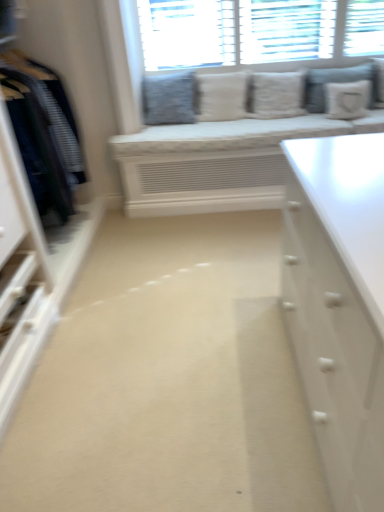
Question: From the image's perspective, is white textured pillow at center, which is counted as the 4th pillow, starting from the right, positioned above or below white textured pillows at upper center?

Choices:
 (A) above
 (B) below

Answer: (B)

Question: Is white textured pillow at center, the second pillow from the left, wider or thinner than white textured pillows at upper center?

Choices:
 (A) wide
 (B) thin

Answer: (A)

Question: Estimate the real-world distances between objects in this image. Which object is farther from the white textured pillow at center, acting as the 3th pillow starting from the right?

Choices:
 (A) gray fabric pillow at upper right, which is the second pillow in right-to-left order
 (B) white textured pillows at upper center
 (C) white fabric pillow at upper right, the fifth pillow when ordered from left to right
 (D) textured gray pillow at upper center, arranged as the fifth pillow when viewed from the right
 (E) dark blue fabric at left

Answer: (E)

Question: Which object is positioned closest to the dark blue fabric at left?

Choices:
 (A) white textured pillow at center, acting as the 3th pillow starting from the right
 (B) beige carpet at center
 (C) white textured pillows at upper center
 (D) textured gray pillow at upper center, the first pillow when ordered from left to right
 (E) white fabric pillow at upper right, placed as the first pillow when sorted from right to left

Answer: (D)